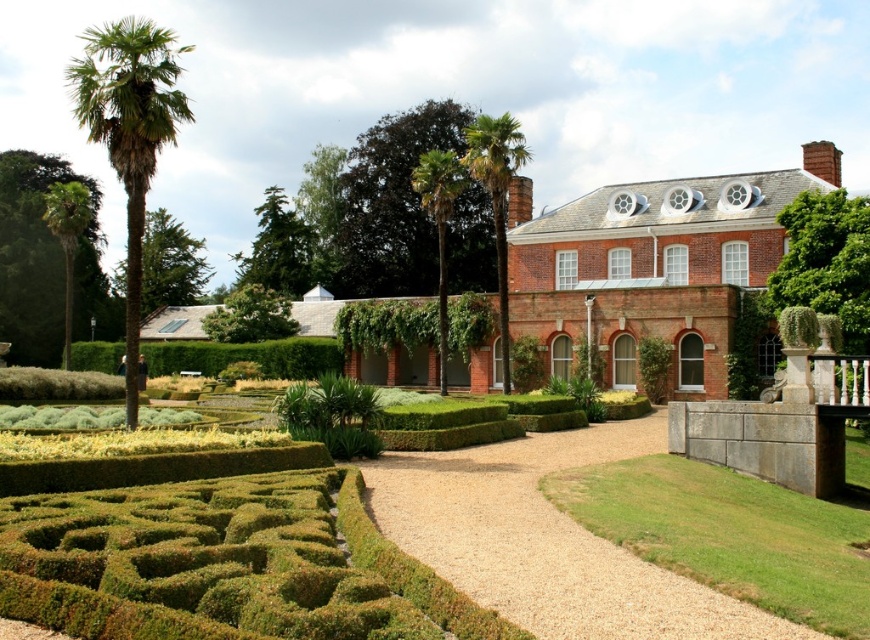
How distant is green leafy hedge at center from green leafy palm at center?

91.78 feet

Is green leafy hedge at center bigger than green leafy palm at center?

Actually, green leafy hedge at center might be smaller than green leafy palm at center.

Who is more distant from viewer, (306, 342) or (419, 182)?

The point (306, 342) is behind.

This screenshot has height=640, width=870. What are the coordinates of `green leafy hedge at center` in the screenshot? It's located at (246, 356).

Which of these two, green leafy palm tree at center or green leafy palm tree at left, stands shorter?

→ Standing shorter between the two is green leafy palm tree at left.

Looking at this image, who is positioned more to the left, green leafy palm tree at center or green leafy palm tree at left?

green leafy palm tree at left

Who is more forward, (499,179) or (72,260)?

Point (499,179) is in front.

The height and width of the screenshot is (640, 870). Find the location of `green leafy palm tree at center`. green leafy palm tree at center is located at coordinates coord(497,198).

Is gravel at center wider than green leafy palm tree at left?

No, gravel at center is not wider than green leafy palm tree at left.

I want to click on gravel at center, so click(x=547, y=540).

You are a GUI agent. You are given a task and a screenshot of the screen. Output one action in this format:
    pyautogui.click(x=<x>, y=<y>)
    Task: Click on the gravel at center
    
    Given the screenshot: What is the action you would take?
    pyautogui.click(x=547, y=540)